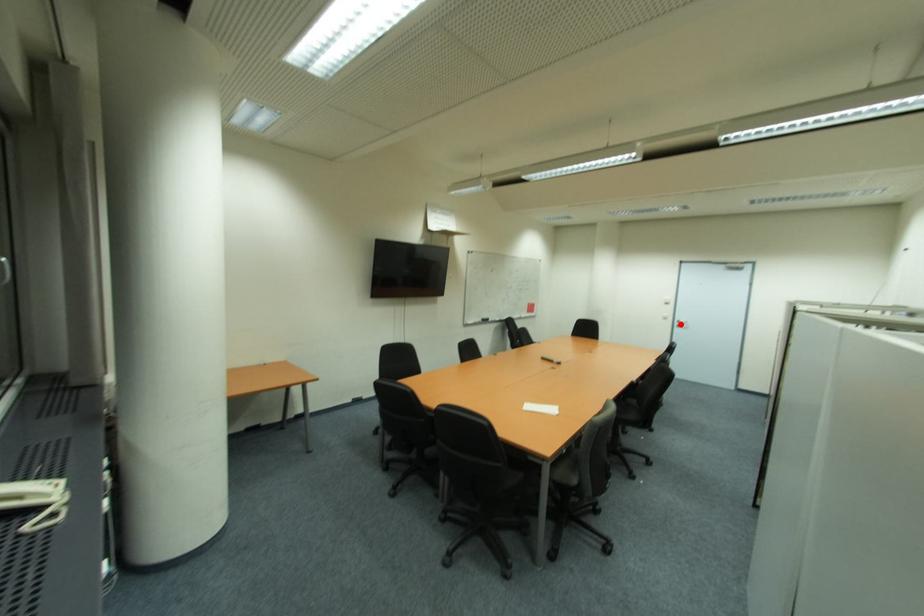
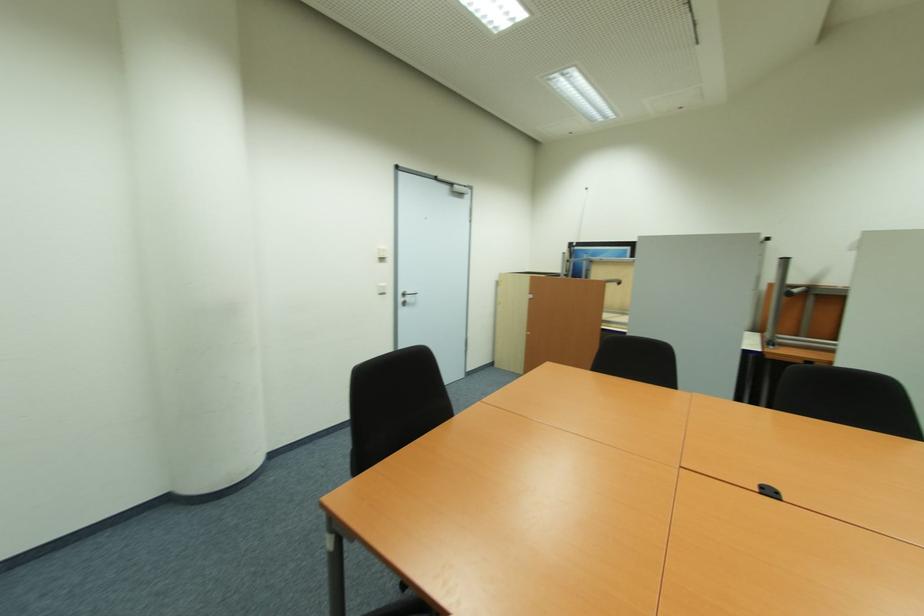
Locate, in the second image, the point that corresponds to the highlighted location in the first image.

(405, 300)